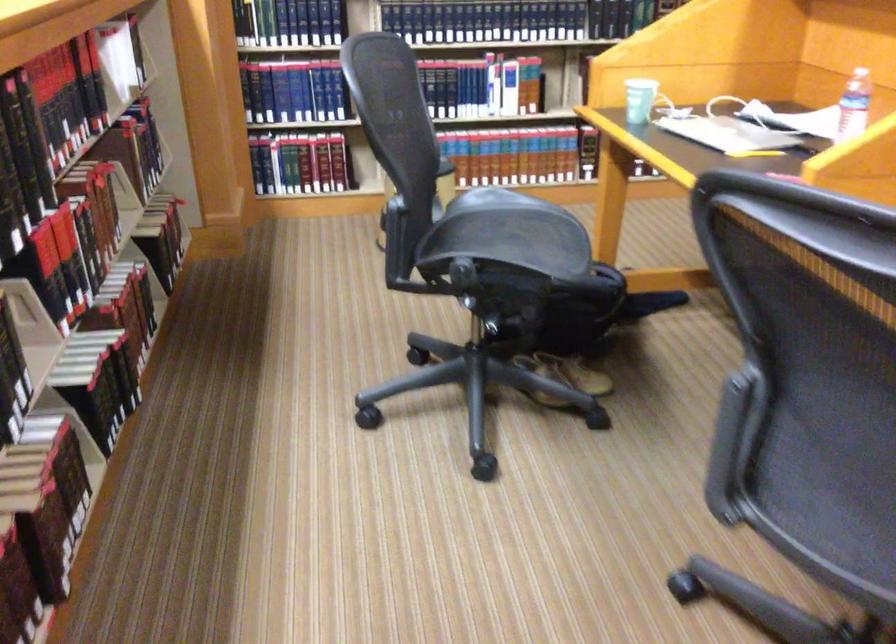
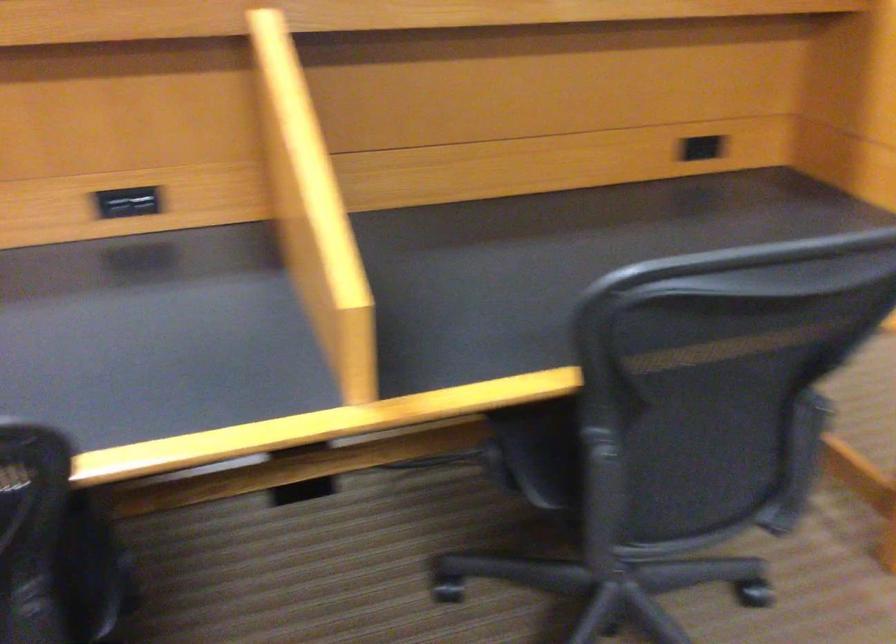
Question: I am providing you with two images of the same scene from different viewpoints. Please identify which objects are invisible in image2.

Choices:
 (A) black power outlet
 (B) chair armrest
 (C) chair sitting surface
 (D) green product box

Answer: (B)